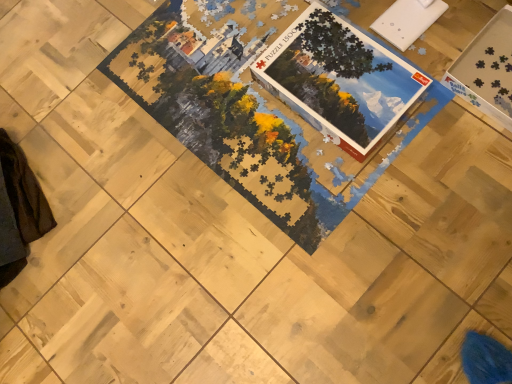
Image resolution: width=512 pixels, height=384 pixels. What do you see at coordinates (487, 69) in the screenshot?
I see `white cardboard puzzle pieces at upper right` at bounding box center [487, 69].

This screenshot has height=384, width=512. In order to click on white cardboard puzzle pieces at upper right in this screenshot , I will do `click(487, 69)`.

What do you see at coordinates (339, 79) in the screenshot? I see `matte cardboard puzzle box at center` at bounding box center [339, 79].

Find the location of a particular element. matte cardboard puzzle box at center is located at coordinates (339, 79).

Image resolution: width=512 pixels, height=384 pixels. Identify the location of white cardboard puzzle pieces at upper right. (487, 69).

Which is more to the left, white cardboard puzzle pieces at upper right or matte cardboard puzzle box at center?

Positioned to the left is matte cardboard puzzle box at center.

Does white cardboard puzzle pieces at upper right come in front of matte cardboard puzzle box at center?

Yes, it is in front of matte cardboard puzzle box at center.

Considering the points (490, 24) and (301, 101), which point is behind, point (490, 24) or point (301, 101)?

The point (490, 24) is behind.

From the image's perspective, is white cardboard puzzle pieces at upper right positioned above or below matte cardboard puzzle box at center?

From the image's perspective, white cardboard puzzle pieces at upper right appears above matte cardboard puzzle box at center.

From a real-world perspective, is white cardboard puzzle pieces at upper right positioned over matte cardboard puzzle box at center based on gravity?

Actually, white cardboard puzzle pieces at upper right is physically below matte cardboard puzzle box at center in the real world.

In the scene shown: Can you confirm if white cardboard puzzle pieces at upper right is thinner than matte cardboard puzzle box at center?

Incorrect, the width of white cardboard puzzle pieces at upper right is not less than that of matte cardboard puzzle box at center.

Is white cardboard puzzle pieces at upper right shorter than matte cardboard puzzle box at center?

No.

Considering the sizes of white cardboard puzzle pieces at upper right and matte cardboard puzzle box at center in the image, is white cardboard puzzle pieces at upper right bigger or smaller than matte cardboard puzzle box at center?

In the image, white cardboard puzzle pieces at upper right appears to be larger than matte cardboard puzzle box at center.

Is white cardboard puzzle pieces at upper right spatially inside matte cardboard puzzle box at center, or outside of it?

white cardboard puzzle pieces at upper right is not inside matte cardboard puzzle box at center, it's outside.

Is white cardboard puzzle pieces at upper right in contact with matte cardboard puzzle box at center?

They are not placed beside each other.

Does white cardboard puzzle pieces at upper right turn towards matte cardboard puzzle box at center?

No, white cardboard puzzle pieces at upper right is not turned towards matte cardboard puzzle box at center.

Locate an element on the screen. square located on the right of matte cardboard puzzle box at center is located at coordinates (487, 69).

Based on their positions, is matte cardboard puzzle box at center located to the left or right of white cardboard puzzle pieces at upper right?

matte cardboard puzzle box at center is positioned on white cardboard puzzle pieces at upper right's left side.

Is matte cardboard puzzle box at center positioned behind white cardboard puzzle pieces at upper right?

That is True.

Does point (377, 113) come in front of point (508, 92)?

Yes, point (377, 113) is closer to viewer.

From the image's perspective, is matte cardboard puzzle box at center beneath white cardboard puzzle pieces at upper right?

Yes, from the image's perspective, matte cardboard puzzle box at center is beneath white cardboard puzzle pieces at upper right.

From a real-world perspective, who is located lower, matte cardboard puzzle box at center or white cardboard puzzle pieces at upper right?

From a 3D spatial view, white cardboard puzzle pieces at upper right is below.

Looking at their sizes, would you say matte cardboard puzzle box at center is wider or thinner than white cardboard puzzle pieces at upper right?

matte cardboard puzzle box at center is thinner than white cardboard puzzle pieces at upper right.

Considering the relative sizes of matte cardboard puzzle box at center and white cardboard puzzle pieces at upper right in the image provided, is matte cardboard puzzle box at center shorter than white cardboard puzzle pieces at upper right?

Yes.

Who is bigger, matte cardboard puzzle box at center or white cardboard puzzle pieces at upper right?

With larger size is white cardboard puzzle pieces at upper right.

Is matte cardboard puzzle box at center surrounding white cardboard puzzle pieces at upper right?

Definitely not — white cardboard puzzle pieces at upper right is not inside matte cardboard puzzle box at center.

Is matte cardboard puzzle box at center next to white cardboard puzzle pieces at upper right and touching it?

They are not placed beside each other.

Is matte cardboard puzzle box at center oriented away from white cardboard puzzle pieces at upper right?

That's not correct — matte cardboard puzzle box at center is not looking away from white cardboard puzzle pieces at upper right.

How different are the orientations of matte cardboard puzzle box at center and white cardboard puzzle pieces at upper right in degrees?

There is a 0.00015-degree angle between the facing directions of matte cardboard puzzle box at center and white cardboard puzzle pieces at upper right.

How much distance is there between matte cardboard puzzle box at center and white cardboard puzzle pieces at upper right?

matte cardboard puzzle box at center and white cardboard puzzle pieces at upper right are 27.25 centimeters apart from each other.

At what (x,y) coordinates should I click in order to perform the action: click on square that is under the matte cardboard puzzle box at center (from a real-world perspective). Please return your answer as a coordinate pair (x, y). Looking at the image, I should click on (487, 69).

The width and height of the screenshot is (512, 384). In order to click on book behind the white cardboard puzzle pieces at upper right in this screenshot , I will do `click(339, 79)`.

Image resolution: width=512 pixels, height=384 pixels. In order to click on book on the left of white cardboard puzzle pieces at upper right in this screenshot , I will do `click(339, 79)`.